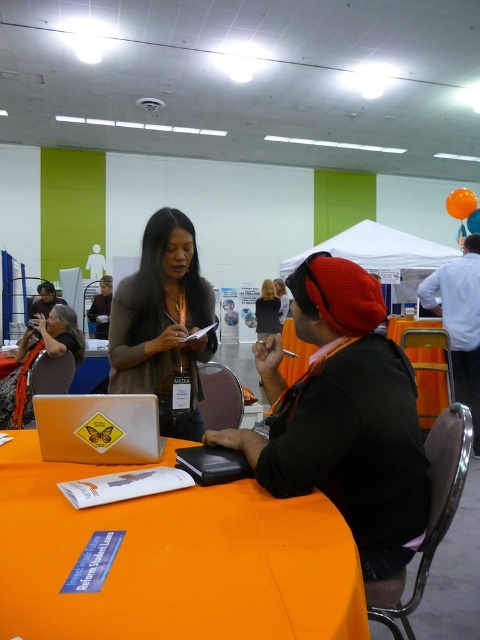
Question: Which object appears closest to the camera in this image?

Choices:
 (A) matte black jacket at center
 (B) matte orange scarf at center
 (C) orange fabric table at center
 (D) yellow matte laptop at center

Answer: (C)

Question: Does matte black jacket at center appear on the left side of yellow matte laptop at center?

Choices:
 (A) no
 (B) yes

Answer: (A)

Question: Which point is closer to the camera?

Choices:
 (A) orange fabric table at center
 (B) matte orange scarf at center
 (C) matte black jacket at center
 (D) yellow matte laptop at center

Answer: (A)

Question: Estimate the real-world distances between objects in this image. Which object is closer to the orange fabric table at center?

Choices:
 (A) matte black jacket at center
 (B) matte orange scarf at center

Answer: (A)

Question: From the image, what is the correct spatial relationship of orange fabric table at center in relation to yellow matte laptop at center?

Choices:
 (A) below
 (B) above

Answer: (A)

Question: Is matte black jacket at center closer to the viewer compared to matte orange scarf at center?

Choices:
 (A) yes
 (B) no

Answer: (A)